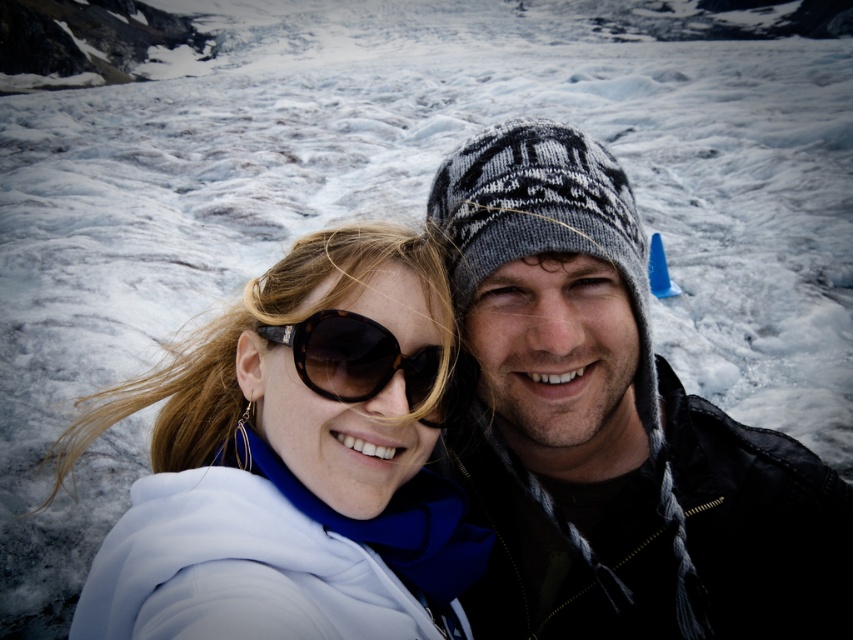
You are taking a photo of two people standing at point (708,516) and point (410,333). Which person is closer to the camera?

The person at point (410,333) is closer to the camera because point (708,516) is behind point (410,333).

You are a photographer trying to capture the knitted wool hat at upper right and the white fabric at center in your photo. Which object should you focus on first if you want to ensure both are in focus? Please explain your reasoning based on their positions.

The knitted wool hat at upper right is above the white fabric at center. Since it is positioned higher in the frame, focusing on the knitted wool hat at upper right first would help ensure both are in focus as the white fabric at center is below it.